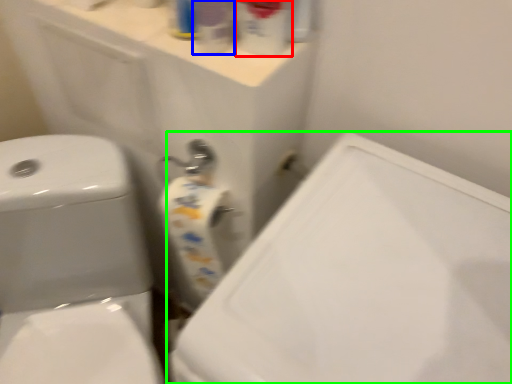
Question: Based on their relative distances, which object is nearer to cleaning product (highlighted by a red box)? Choose from cleaning product (highlighted by a blue box) and porcelain (highlighted by a green box).

Choices:
 (A) cleaning product
 (B) porcelain

Answer: (A)